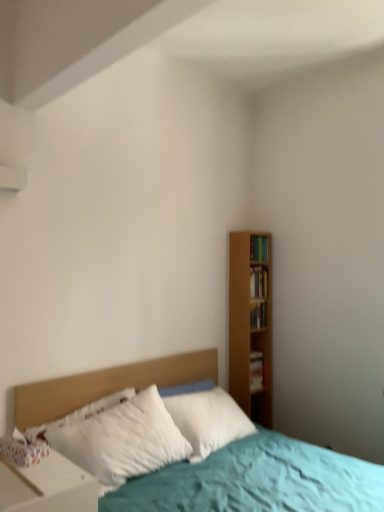
Locate an element on the screen. empty space that is ontop of wooden bookshelf at right, the third book when ordered from bottom to top (from a real-world perspective) is located at coordinates (259, 271).